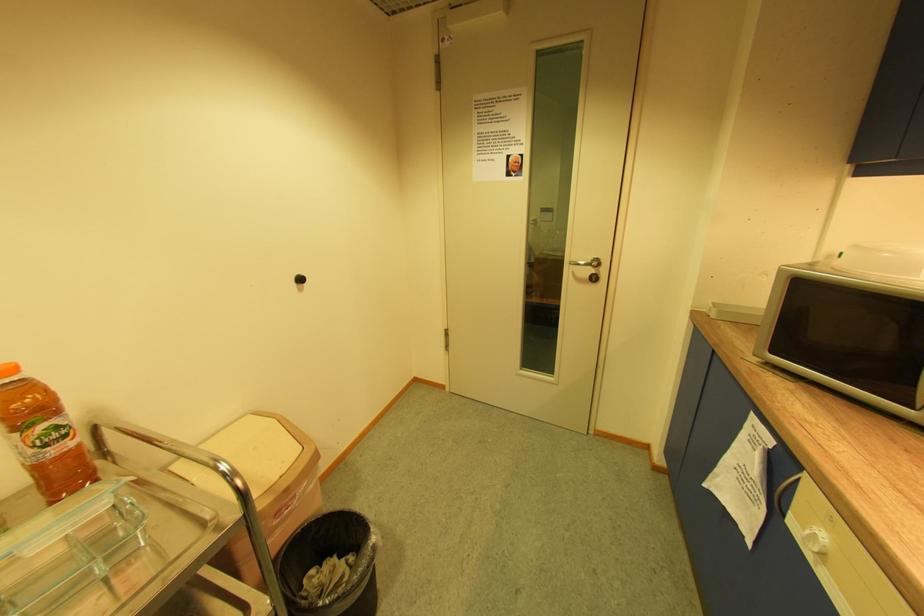
The height and width of the screenshot is (616, 924). What do you see at coordinates (812, 541) in the screenshot?
I see `the white appliance dial` at bounding box center [812, 541].